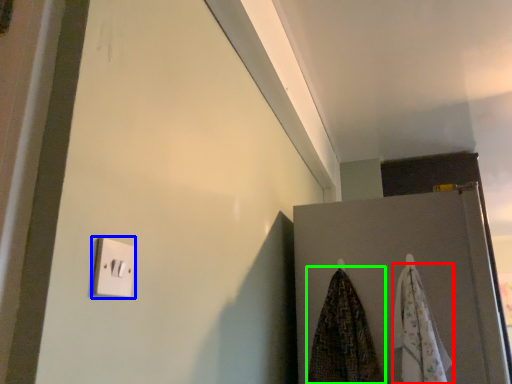
Question: Based on their relative distances, which object is farther from beach towel (highlighted by a red box)? Choose from light switch (highlighted by a blue box) and beach towel (highlighted by a green box).

Choices:
 (A) light switch
 (B) beach towel

Answer: (A)